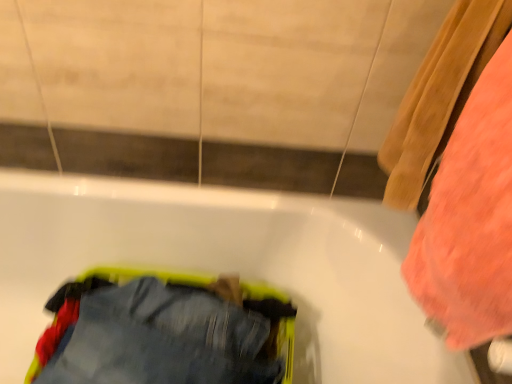
Image resolution: width=512 pixels, height=384 pixels. What do you see at coordinates (227, 266) in the screenshot?
I see `white glossy bathtub at center` at bounding box center [227, 266].

Locate an element on the screen. fluffy coral towel at right is located at coordinates (470, 219).

Which object is wider, denim pants at lower left or white glossy bathtub at center?

white glossy bathtub at center.

Which is more to the left, denim pants at lower left or white glossy bathtub at center?

white glossy bathtub at center is more to the left.

The width and height of the screenshot is (512, 384). I want to click on trousers located on the right of white glossy bathtub at center, so click(x=164, y=333).

In terms of height, does denim pants at lower left look taller or shorter compared to white glossy bathtub at center?

denim pants at lower left is shorter than white glossy bathtub at center.

How far apart are fluffy coral towel at right and denim pants at lower left?

The distance of fluffy coral towel at right from denim pants at lower left is 22.46 inches.

From a real-world perspective, is fluffy coral towel at right physically located above or below denim pants at lower left?

Clearly, from a real-world perspective, fluffy coral towel at right is above denim pants at lower left.

Is fluffy coral towel at right facing away from denim pants at lower left?

A: No, fluffy coral towel at right is not facing away from denim pants at lower left.

In the scene shown: Can you tell me how much fluffy coral towel at right and denim pants at lower left differ in facing direction?

The angle between the facing direction of fluffy coral towel at right and the facing direction of denim pants at lower left is 90 degrees.

Considering the positions of objects denim pants at lower left and fluffy coral towel at right in the image provided, who is more to the right, denim pants at lower left or fluffy coral towel at right?

fluffy coral towel at right.

Which object is further away from the camera taking this photo, denim pants at lower left or fluffy coral towel at right?

denim pants at lower left is further from the camera.

From the picture: Is fluffy coral towel at right completely or partially inside denim pants at lower left?

Definitely not — fluffy coral towel at right is not inside denim pants at lower left.

This screenshot has width=512, height=384. I want to click on trousers below the fluffy coral towel at right (from the image's perspective), so click(x=164, y=333).

Relative to denim pants at lower left, is white glossy bathtub at center in front or behind?

Visually, white glossy bathtub at center is located in front of denim pants at lower left.

Consider the image. How distant is white glossy bathtub at center from denim pants at lower left?

white glossy bathtub at center and denim pants at lower left are 9.24 inches apart.

Does white glossy bathtub at center have a lesser width compared to denim pants at lower left?

In fact, white glossy bathtub at center might be wider than denim pants at lower left.

Is white glossy bathtub at center taller or shorter than denim pants at lower left?

Clearly, white glossy bathtub at center is taller compared to denim pants at lower left.

Considering the relative sizes of fluffy coral towel at right and white glossy bathtub at center in the image provided, is fluffy coral towel at right shorter than white glossy bathtub at center?

Yes, fluffy coral towel at right is shorter than white glossy bathtub at center.

From the image's perspective, does fluffy coral towel at right appear higher than white glossy bathtub at center?

Indeed, from the image's perspective, fluffy coral towel at right is shown above white glossy bathtub at center.

Find the location of `clothing above the white glossy bathtub at center (from the image's perspective)`. clothing above the white glossy bathtub at center (from the image's perspective) is located at coordinates (470, 219).

From a real-world perspective, which object rests below the other?

white glossy bathtub at center, from a real-world perspective.

Between white glossy bathtub at center and fluffy coral towel at right, which one has larger size?

With larger size is white glossy bathtub at center.

Is white glossy bathtub at center aimed at fluffy coral towel at right?

No, white glossy bathtub at center is not facing towards fluffy coral towel at right.

The image size is (512, 384). Find the location of `clothing that is above the white glossy bathtub at center (from a real-world perspective)`. clothing that is above the white glossy bathtub at center (from a real-world perspective) is located at coordinates (470, 219).

Find the location of a particular element. trousers located above the white glossy bathtub at center (from the image's perspective) is located at coordinates click(x=164, y=333).

This screenshot has height=384, width=512. Find the location of `trousers on the left side of fluffy coral towel at right`. trousers on the left side of fluffy coral towel at right is located at coordinates (164, 333).

Considering their positions, is white glossy bathtub at center positioned closer to denim pants at lower left than fluffy coral towel at right?

white glossy bathtub at center.

Which object lies nearer to the anchor point white glossy bathtub at center, denim pants at lower left or fluffy coral towel at right?

denim pants at lower left is positioned closer to the anchor white glossy bathtub at center.

Looking at the image, which one is located further to fluffy coral towel at right, white glossy bathtub at center or denim pants at lower left?

denim pants at lower left lies further to fluffy coral towel at right than the other object.

When comparing their distances from fluffy coral towel at right, does denim pants at lower left or white glossy bathtub at center seem further?

Among the two, denim pants at lower left is located further to fluffy coral towel at right.

Based on their spatial positions, is fluffy coral towel at right or denim pants at lower left further from white glossy bathtub at center?

fluffy coral towel at right.

Considering their positions, is fluffy coral towel at right positioned further to denim pants at lower left than white glossy bathtub at center?

Among the two, fluffy coral towel at right is located further to denim pants at lower left.

At what (x,y) coordinates should I click in order to perform the action: click on trousers located between white glossy bathtub at center and fluffy coral towel at right in the left-right direction. Please return your answer as a coordinate pair (x, y). Looking at the image, I should click on (164, 333).